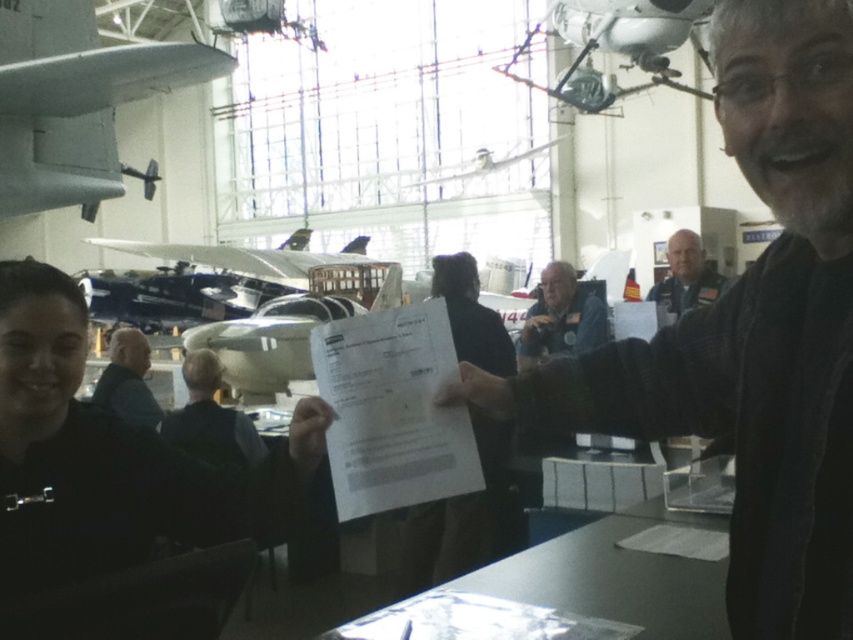
Which of these two, dark gray fabric jacket at left or gray uniform at center, stands shorter?

dark gray fabric jacket at left

Can you confirm if dark gray fabric jacket at left is positioned to the left of gray uniform at center?

Indeed, dark gray fabric jacket at left is positioned on the left side of gray uniform at center.

Which is behind, point (142, 397) or point (718, 285)?

The point (718, 285) is behind.

Locate an element on the screen. Image resolution: width=853 pixels, height=640 pixels. dark gray fabric jacket at left is located at coordinates (126, 380).

Does point (457, 308) come closer to viewer compared to point (155, 420)?

That is True.

Can you confirm if white paper at center is positioned below dark gray fabric jacket at left?

Yes.

Is point (498, 458) positioned before point (125, 404)?

Yes, point (498, 458) is closer to viewer.

At what (x,y) coordinates should I click in order to perform the action: click on white paper at center. Please return your answer as a coordinate pair (x, y). This screenshot has height=640, width=853. Looking at the image, I should click on (473, 513).

Does point (183, 81) come behind point (155, 417)?

No, it is in front of (155, 417).

Who is more forward, (111, 131) or (112, 394)?

Positioned in front is point (112, 394).

Between point (16, 113) and point (131, 364), which one is positioned behind?

Point (131, 364)

Locate an element on the screen. The image size is (853, 640). matte gray airplane wing at upper left is located at coordinates (74, 100).